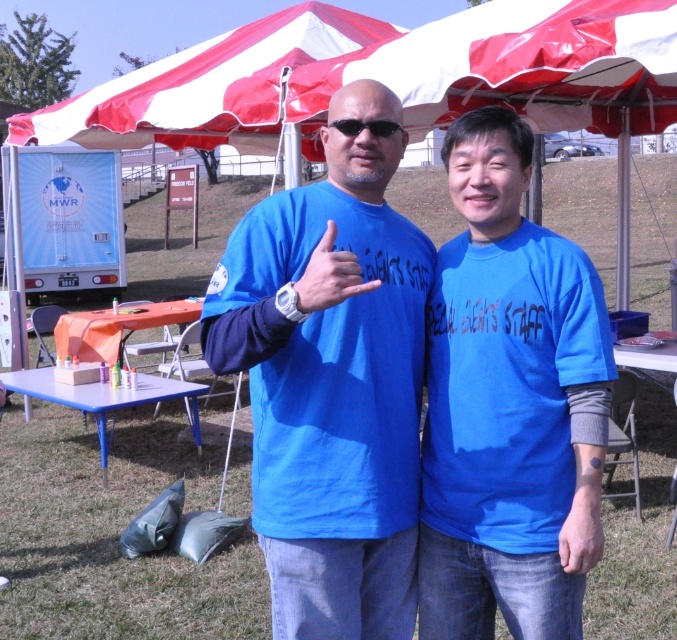
You are standing at the position of the person on the left. You need to determine which of the two points, point (519, 163) or point (131, 108), is closer to you. Which one is closer?

Point (519, 163) is closer to the viewer than point (131, 108), so the person on the left would perceive point (519, 163) as closer.

Please look at the coordinates point (x=508, y=404) in the image. What object is located there?

The point (x=508, y=404) indicates the blue matte shirt at center.

You are a photographer setting up for a group photo. You notice the blue matte shirt at center and the black plastic sunglasses at center in the scene. If your camera has a minimum focus distance of 24 inches, will you be able to focus on both objects simultaneously?

The blue matte shirt at center is 23.46 inches from the black plastic sunglasses at center. Since the distance between them is less than the camera minimum focus distance of 24 inches, the camera may not be able to focus on both objects simultaneously.